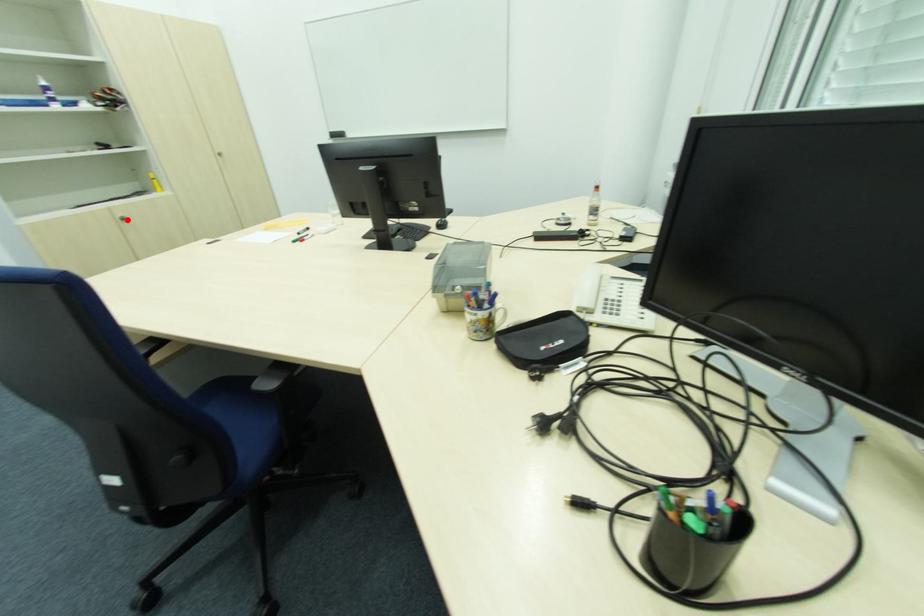
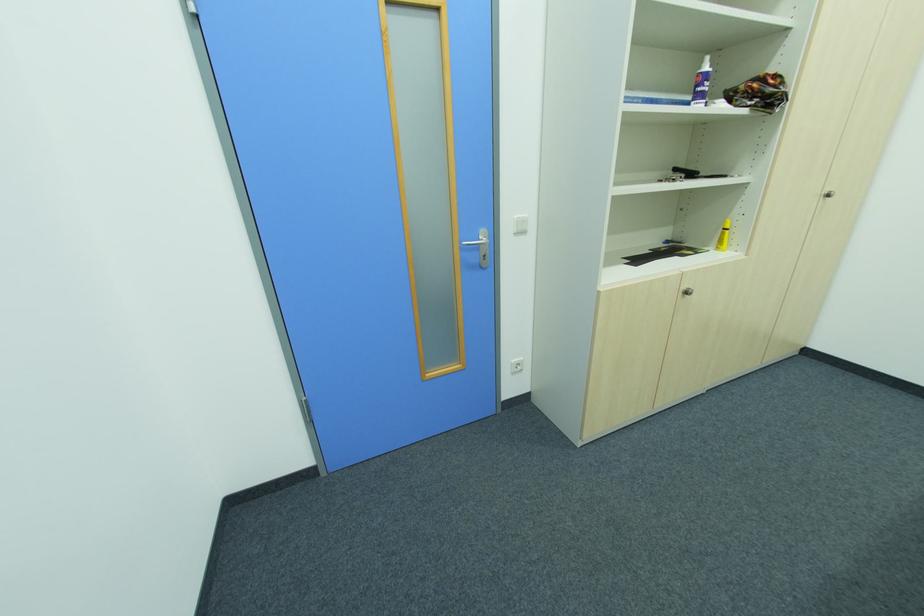
Question: A red point is marked in image1. In image2, is the corresponding 3D point closer to the camera or farther? Reply with the corresponding letter.

Choices:
 (A) The corresponding 3D point is closer.
 (B) The corresponding 3D point is farther.

Answer: (A)